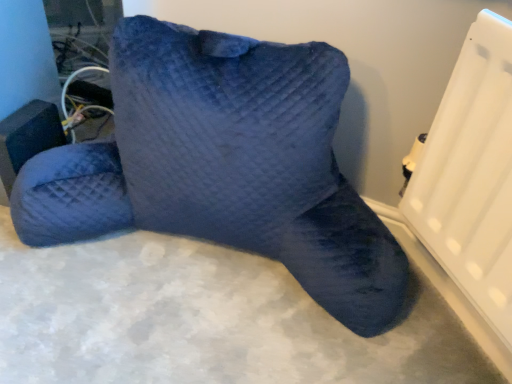
Question: Is velvet blue pillow at center inside the boundaries of matte black speaker at lower left, or outside?

Choices:
 (A) outside
 (B) inside

Answer: (A)

Question: Considering the relative positions of velvet blue pillow at center and matte black speaker at lower left in the image provided, is velvet blue pillow at center to the left or to the right of matte black speaker at lower left?

Choices:
 (A) right
 (B) left

Answer: (A)

Question: Considering their positions, is velvet blue pillow at center located in front of or behind matte black speaker at lower left?

Choices:
 (A) front
 (B) behind

Answer: (A)

Question: Based on their positions, is matte black speaker at lower left located to the left or right of velvet blue pillow at center?

Choices:
 (A) right
 (B) left

Answer: (B)

Question: Considering the positions of matte black speaker at lower left and velvet blue pillow at center in the image, is matte black speaker at lower left bigger or smaller than velvet blue pillow at center?

Choices:
 (A) big
 (B) small

Answer: (B)

Question: From a real-world perspective, is matte black speaker at lower left positioned above or below velvet blue pillow at center?

Choices:
 (A) below
 (B) above

Answer: (A)

Question: Is matte black speaker at lower left inside the boundaries of velvet blue pillow at center, or outside?

Choices:
 (A) inside
 (B) outside

Answer: (A)